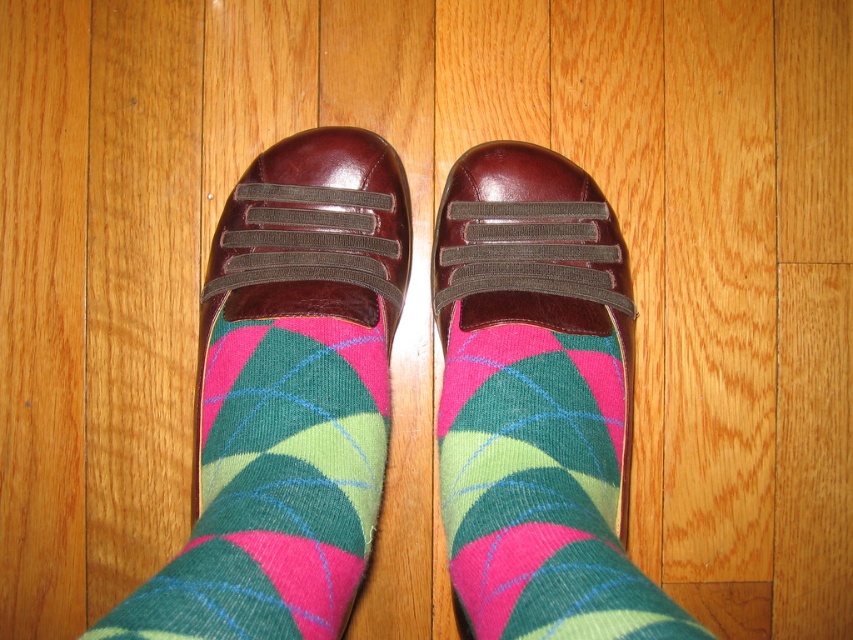
Can you confirm if green argyle sock at center is shorter than multicolored knitted sock at center?

Yes, green argyle sock at center is shorter than multicolored knitted sock at center.

Identify the location of green argyle sock at center. Image resolution: width=853 pixels, height=640 pixels. (276, 486).

Is point (296, 451) closer to camera compared to point (444, 401)?

Yes, point (296, 451) is closer to viewer.

Identify the location of green argyle sock at center. This screenshot has height=640, width=853. (276, 486).